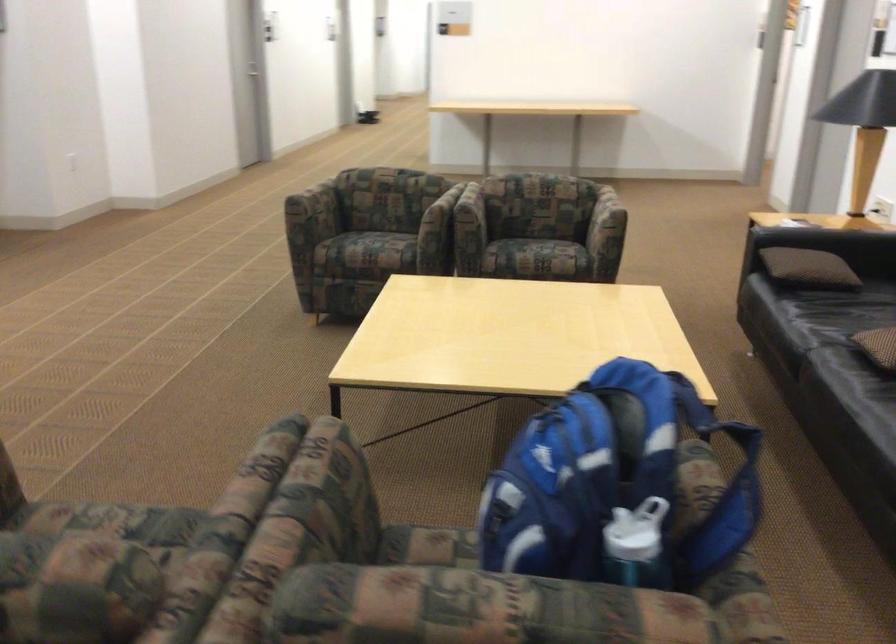
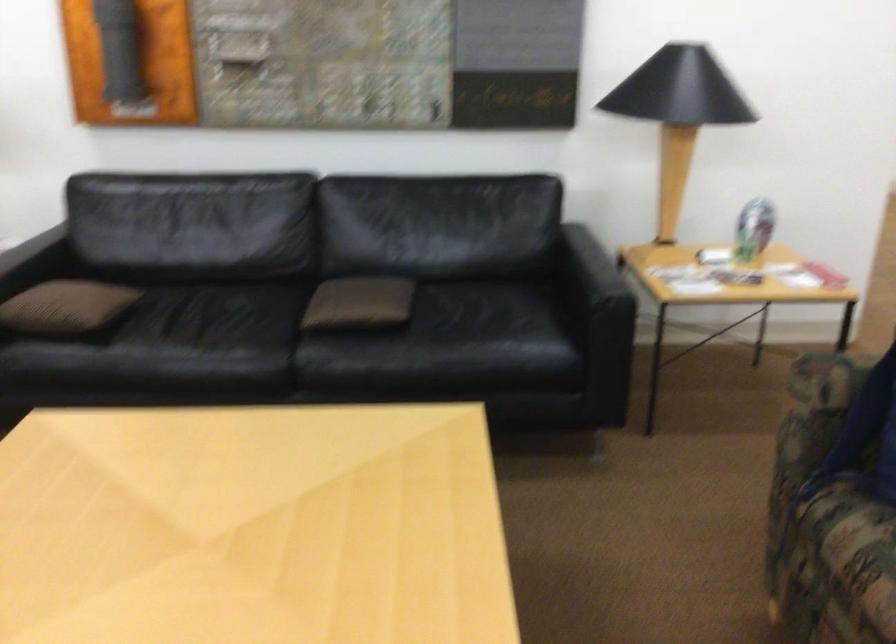
Locate, in the second image, the point that corresponds to point 776,252 in the first image.

(65, 308)